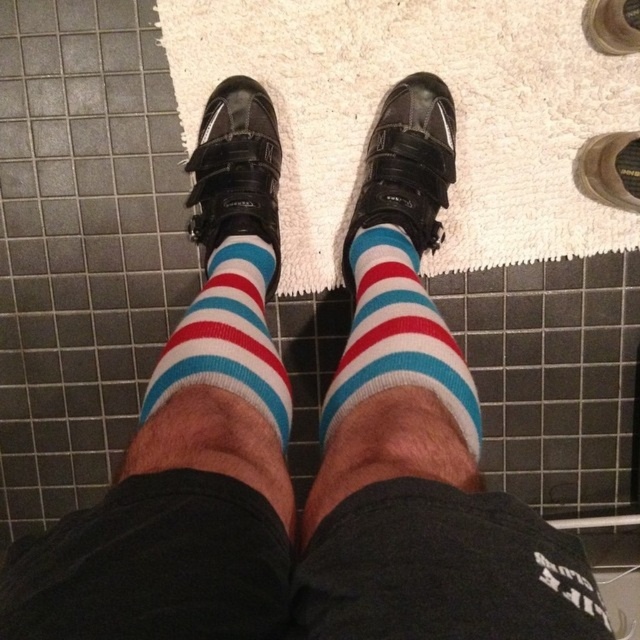
You are a fashion designer observing the image. You notice the striped sock at center and the striped cotton socks at center. Which one is visible on top?

The striped sock at center is visible on top of the striped cotton socks at center.